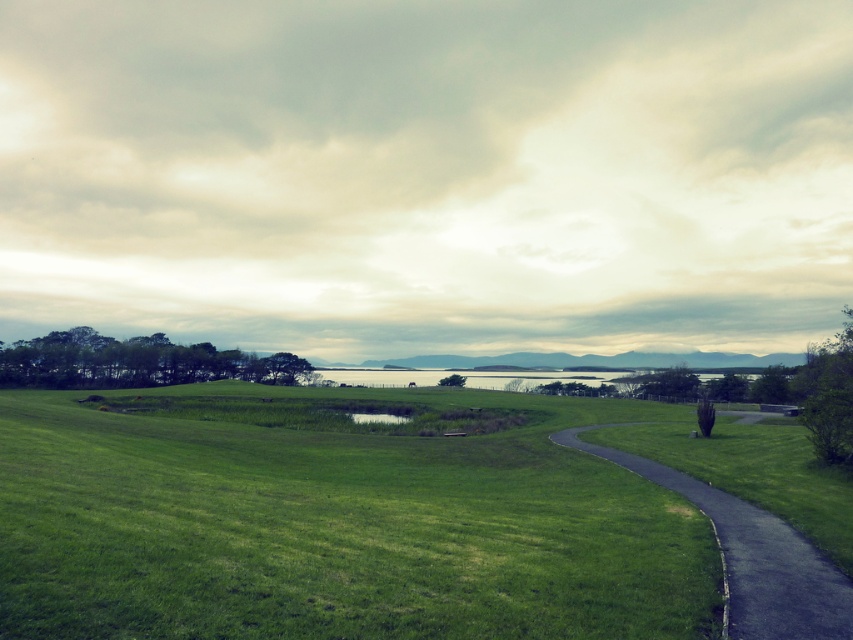
Looking at this image, you are planning to walk from the bottom right corner of the image towards the horizon. You see the green grassy field at center and the dark gray asphalt path at lower right. Which path should you take to cover more ground quickly?

The green grassy field at center is larger in size than the dark gray asphalt path at lower right, so taking the green grassy field at center would allow you to cover more ground quickly.